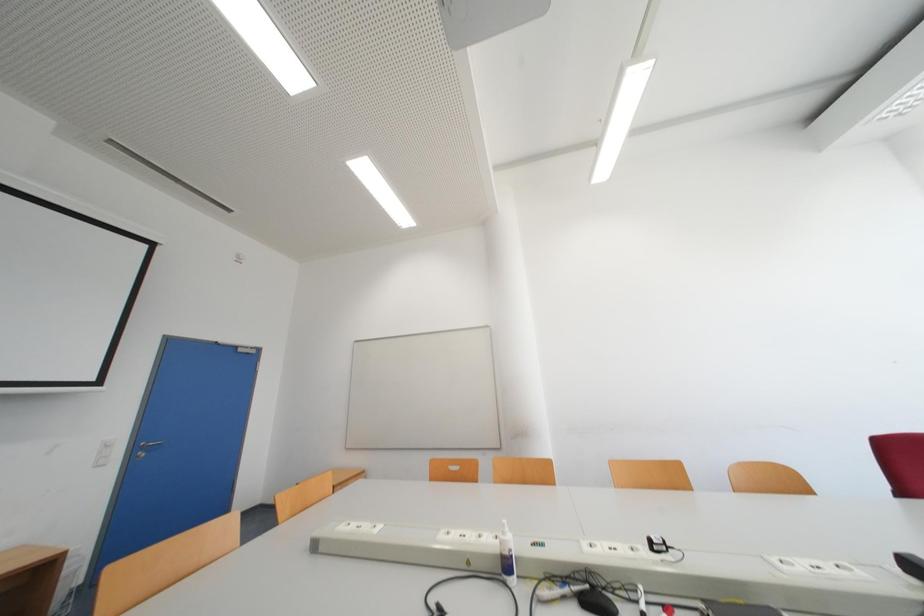
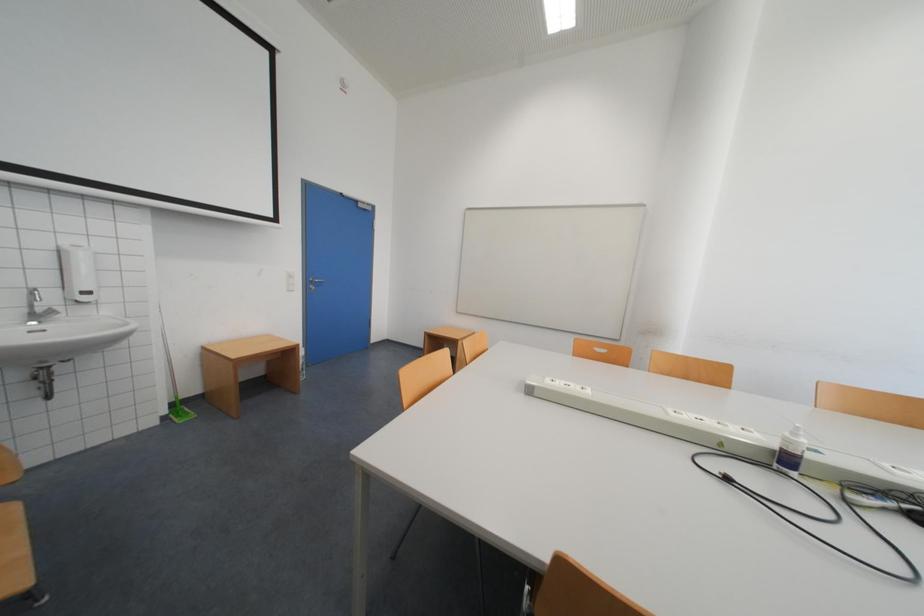
Question: Based on the continuous images, in which direction is the camera rotating? Reply with the corresponding letter.

Choices:
 (A) Left
 (B) Right
 (C) Up
 (D) Down

Answer: (D)